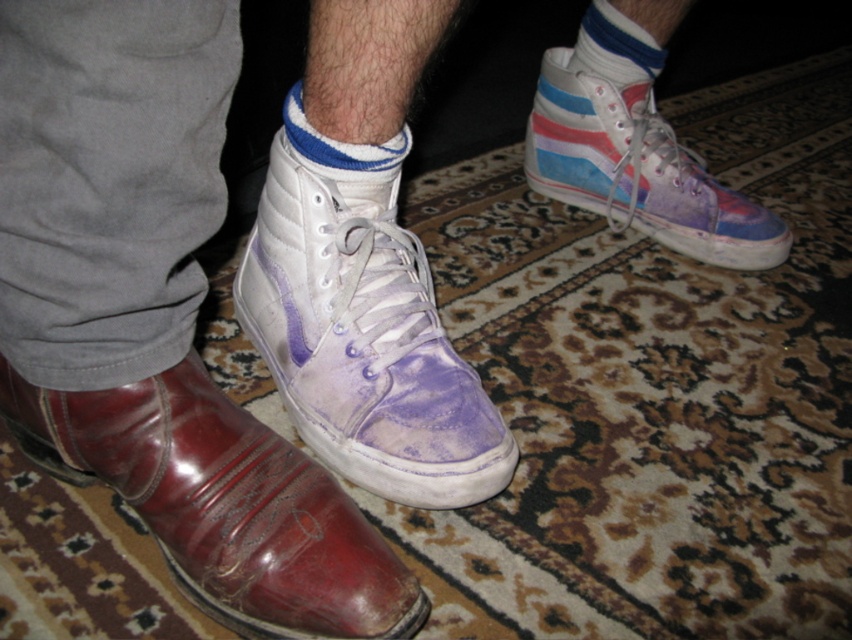
Is point (318, 195) positioned behind point (214, 547)?

That is True.

Does purple suede sneaker at center have a greater height compared to shiny brown leather boot at lower left?

Indeed, purple suede sneaker at center has a greater height compared to shiny brown leather boot at lower left.

Identify the location of purple suede sneaker at center. (363, 339).

Locate an element on the screen. Image resolution: width=852 pixels, height=640 pixels. purple suede sneaker at center is located at coordinates (363, 339).

Does blue striped sock at upper center come behind blue striped sock at center?

Yes, blue striped sock at upper center is behind blue striped sock at center.

Image resolution: width=852 pixels, height=640 pixels. What do you see at coordinates (614, 45) in the screenshot?
I see `blue striped sock at upper center` at bounding box center [614, 45].

Locate an element on the screen. Image resolution: width=852 pixels, height=640 pixels. blue striped sock at upper center is located at coordinates (614, 45).

Identify the location of purple suede sneaker at center. (363, 339).

Can you confirm if purple suede sneaker at center is shorter than purple suede sneaker at upper right?

Yes, purple suede sneaker at center is shorter than purple suede sneaker at upper right.

Does point (353, 198) come farther from viewer compared to point (668, 148)?

That is False.

This screenshot has height=640, width=852. In order to click on purple suede sneaker at center in this screenshot , I will do `click(363, 339)`.